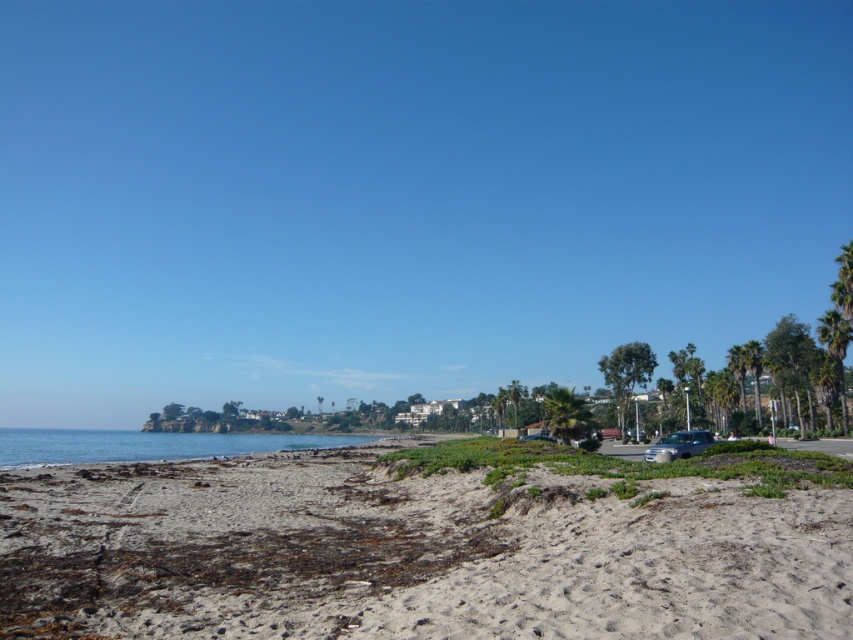
Based on the photo, you are standing on the sandy beach in the coastal scene and want to walk to both the point at coordinates (57,460) and the point at (624,429). Which point will you reach first if you start walking straight ahead?

You will reach the point at coordinates (57,460) first because it is closer to you than the point at (624,429).